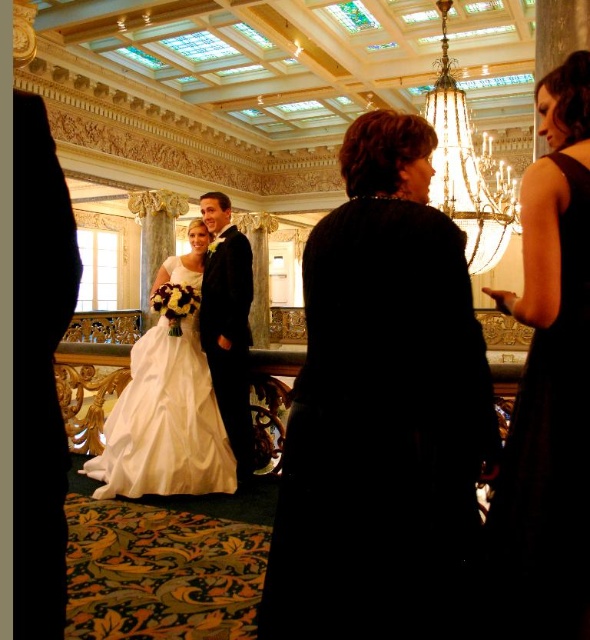
You are a photographer positioned at the entrance of the hall. You need to take a photo of the dark velvet dress at center. Based on its coordinates, where should you aim your camera?

The dark velvet dress at center is located at coordinates point (x=381, y=410), so you should aim your camera towards that position to capture it.

You are standing in the grand hall and see two points marked in the scene. Which point is closer to you, point (417, 148) or point (519, 314)?

Point (417, 148) is closer to you because it is further to the viewer than point (519, 314).